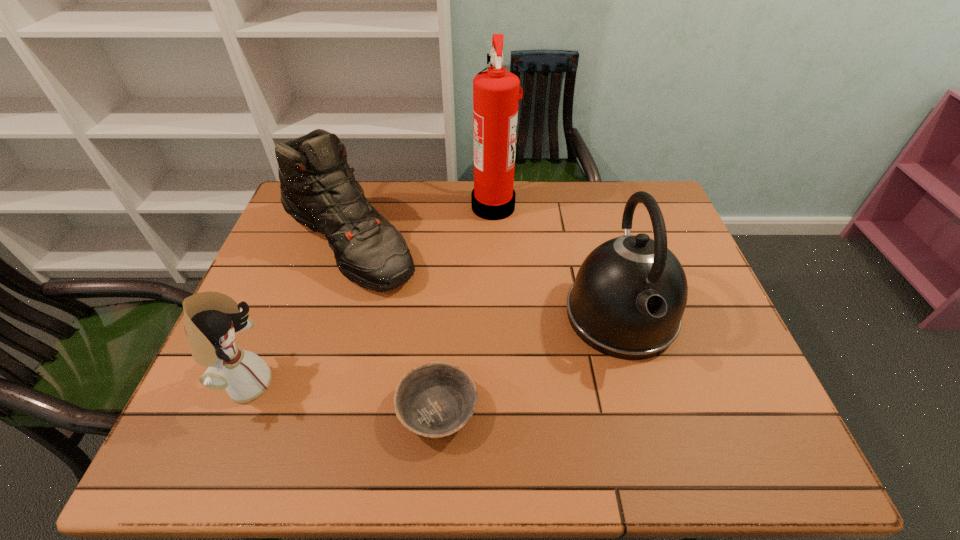
Image resolution: width=960 pixels, height=540 pixels. I want to click on fire extinguisher, so click(496, 96).

Locate an element on the screen. Image resolution: width=960 pixels, height=540 pixels. ski boot is located at coordinates (x=318, y=189).

Find the location of a particular element. The width and height of the screenshot is (960, 540). kettle is located at coordinates (630, 293).

Identify the location of doll. (211, 319).

Find the location of a particular element. This screenshot has width=960, height=540. bowl is located at coordinates pos(434,400).

I want to click on vacant area situated 0.120m with the nozzle aimed from the fire extinguisher, so click(435, 205).

You are a GUI agent. You are given a task and a screenshot of the screen. Output one action in this format:
    pyautogui.click(x=<x>, y=<y>)
    Task: Click on the vacant position located with the nozzle aimed from the fire extinguisher
    
    Given the screenshot: What is the action you would take?
    pyautogui.click(x=393, y=205)

You are a GUI agent. You are given a task and a screenshot of the screen. Output one action in this format:
    pyautogui.click(x=<x>, y=<y>)
    Task: Click on the free spot located 0.300m with the nozzle aimed from the fire extinguisher
    Image resolution: width=960 pixels, height=540 pixels.
    Given the screenshot: What is the action you would take?
    pyautogui.click(x=381, y=205)

I want to click on free space located 0.350m on the front of the ski boot, so click(292, 424).

Image resolution: width=960 pixels, height=540 pixels. I want to click on free space located 0.050m on the spout of the rightmost object, so click(x=641, y=387).